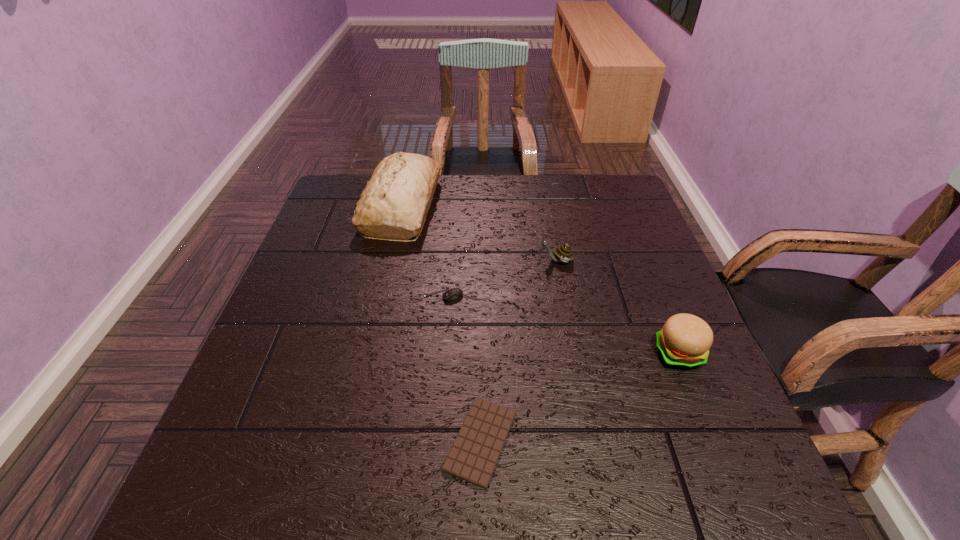
The width and height of the screenshot is (960, 540). I want to click on the tallest object, so click(394, 204).

Locate an element on the screen. The width and height of the screenshot is (960, 540). bread is located at coordinates (394, 204).

Image resolution: width=960 pixels, height=540 pixels. I want to click on snail, so click(563, 253).

You are a GUI agent. You are given a task and a screenshot of the screen. Output one action in this format:
    pyautogui.click(x=<x>, y=<y>)
    Task: Click on the fourth nearest object
    
    Given the screenshot: What is the action you would take?
    pyautogui.click(x=563, y=253)

You are a GUI agent. You are given a task and a screenshot of the screen. Output one action in this format:
    pyautogui.click(x=<x>, y=<y>)
    Task: Click on the second nearest object
    
    Given the screenshot: What is the action you would take?
    pyautogui.click(x=684, y=342)

The width and height of the screenshot is (960, 540). What are the coordinates of `the rightmost object` in the screenshot? It's located at (684, 342).

Locate an element on the screen. This screenshot has height=540, width=960. the third nearest object is located at coordinates (455, 293).

You are a GUI agent. You are given a task and a screenshot of the screen. Output one action in this format:
    pyautogui.click(x=<x>, y=<y>)
    Task: Click on the mouse
    This screenshot has width=960, height=540.
    Given the screenshot: What is the action you would take?
    pyautogui.click(x=455, y=293)

Find the location of a particular element. This screenshot has height=540, width=960. chocolate bar is located at coordinates (473, 456).

Where is `the nearest object`? The height and width of the screenshot is (540, 960). the nearest object is located at coordinates (473, 456).